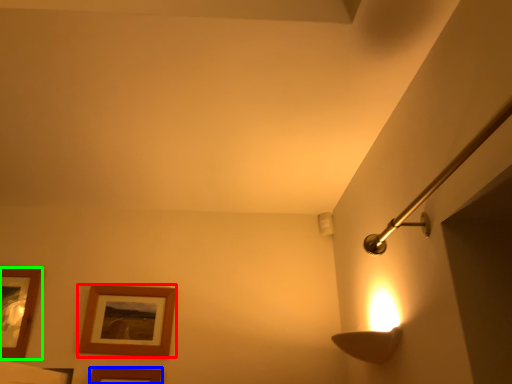
Question: Which is nearer to the picture frame (highlighted by a red box)? picture frame (highlighted by a blue box) or picture frame (highlighted by a green box).

Choices:
 (A) picture frame
 (B) picture frame

Answer: (A)